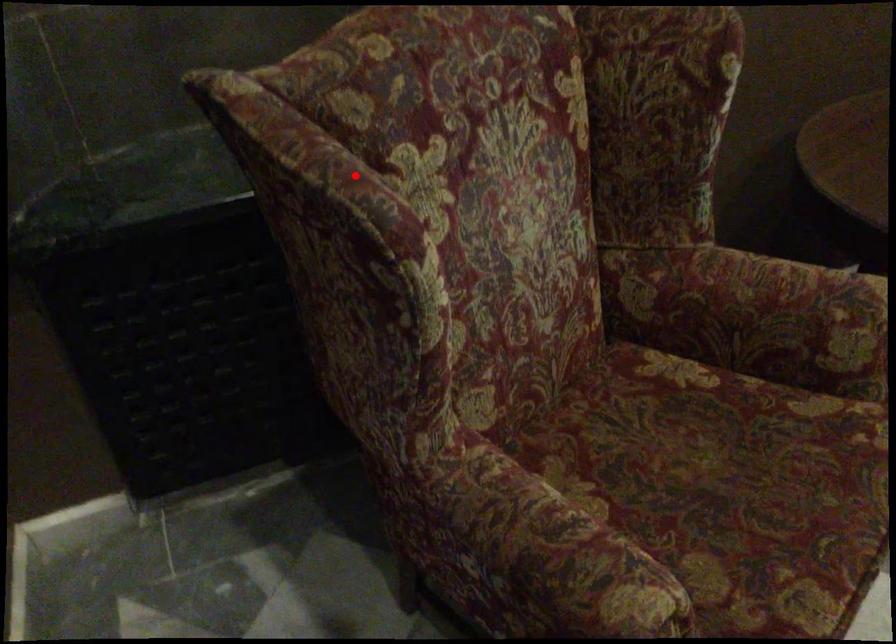
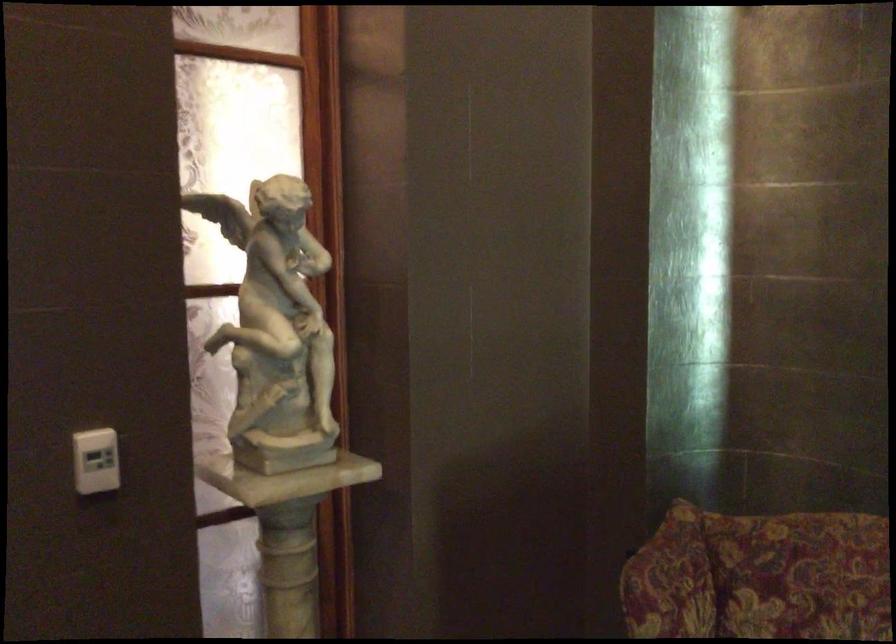
In the second image, find the point that corresponds to the highlighted location in the first image.

(670, 581)